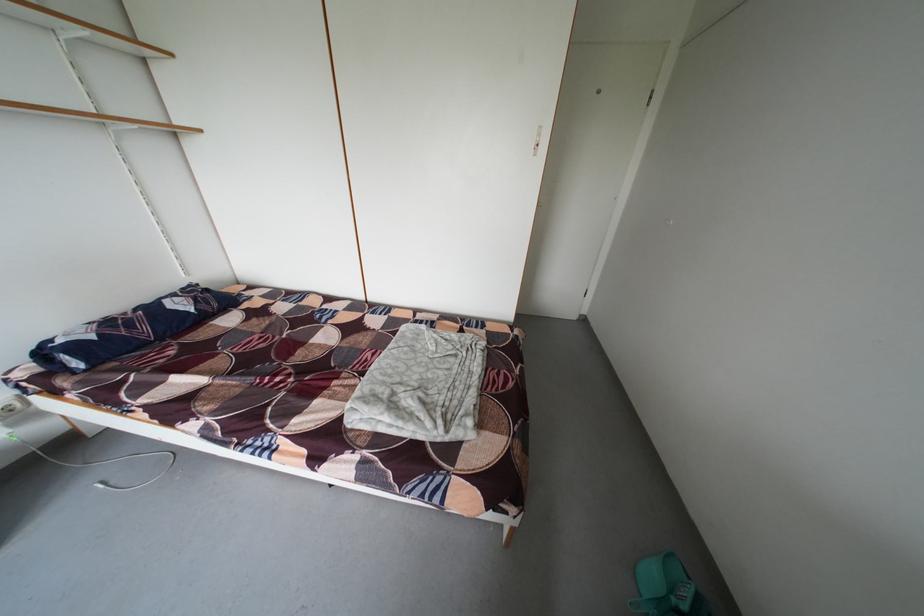
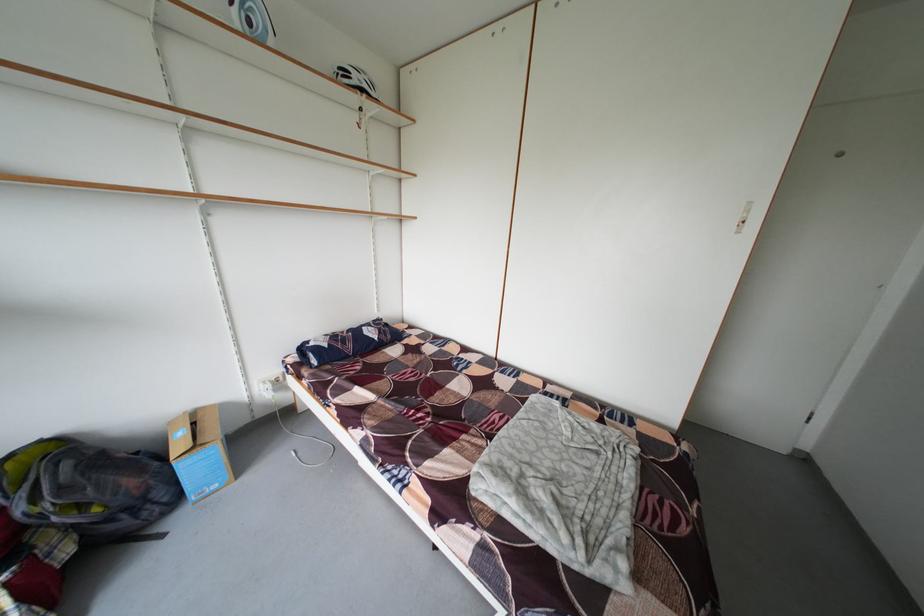
Question: The camera is either moving clockwise (left) or counter-clockwise (right) around the object. The first image is from the beginning of the video and the second image is from the end. Is the camera moving left or right when shooting the video?

Choices:
 (A) Left
 (B) Right

Answer: (B)